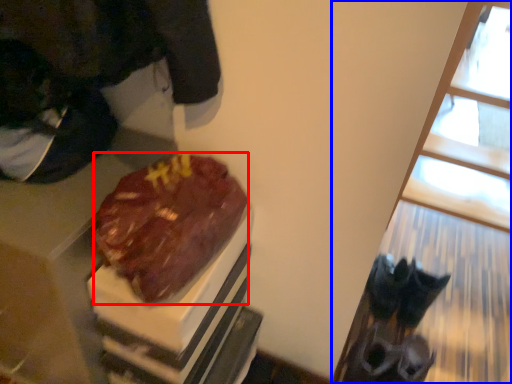
Question: Which point is closer to the camera, chocolate cake (highlighted by a red box) or window (highlighted by a blue box)?

Choices:
 (A) chocolate cake
 (B) window

Answer: (B)